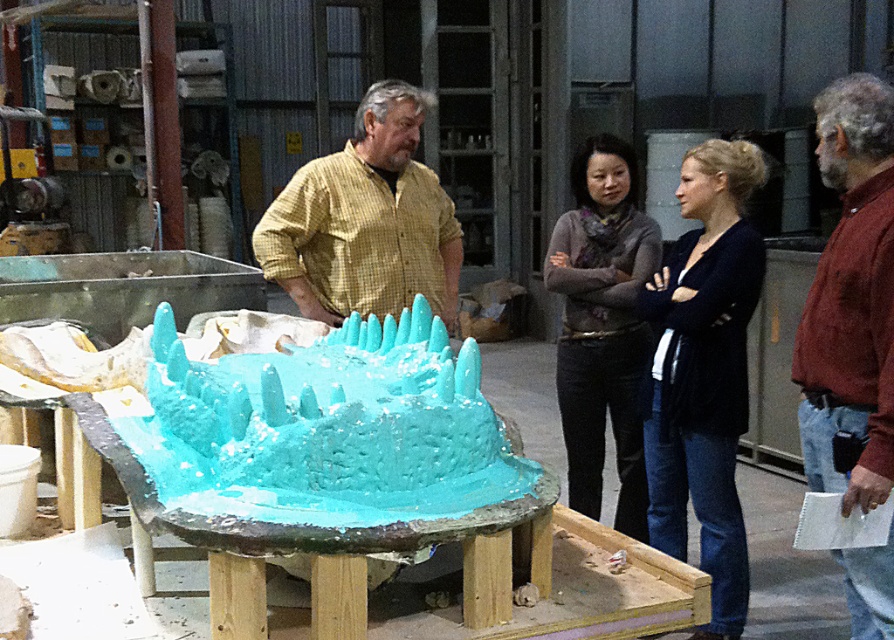
Question: Based on their relative distances, which object is nearer to the knitted scarf at center?

Choices:
 (A) turquoise clay sculpture at center
 (B) yellow checkered shirt at center

Answer: (B)

Question: Is yellow checkered shirt at center bigger than knitted scarf at center?

Choices:
 (A) no
 (B) yes

Answer: (A)

Question: Can you confirm if turquoise clay sculpture at center is positioned to the right of yellow checkered shirt at center?

Choices:
 (A) yes
 (B) no

Answer: (B)

Question: Estimate the real-world distances between objects in this image. Which object is closer to the black sweater at center?

Choices:
 (A) yellow checkered shirt at center
 (B) maroon textured shirt at center right

Answer: (B)

Question: Among these objects, which one is farthest from the camera?

Choices:
 (A) knitted scarf at center
 (B) black sweater at center

Answer: (A)

Question: Is turquoise clay sculpture at center bigger than black sweater at center?

Choices:
 (A) yes
 (B) no

Answer: (B)